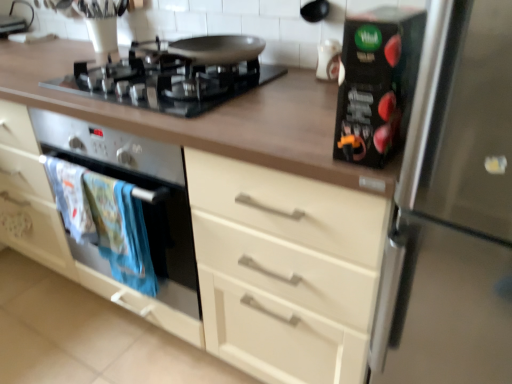
Locate an element on the screen. This screenshot has width=512, height=384. vacant area that lies between black glass gas stove at upper center and white glossy vase at upper center, which is the 2th appliance in front-to-back order is located at coordinates (279, 87).